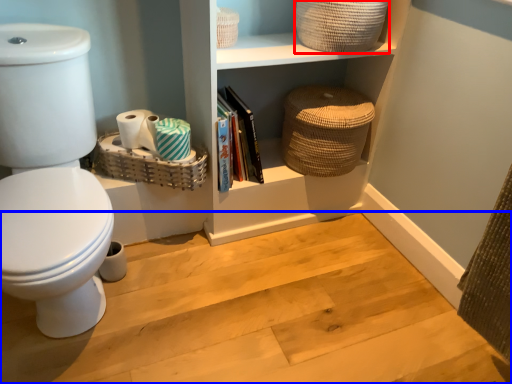
Question: Which point is further to the camera, basket (highlighted by a red box) or stair (highlighted by a blue box)?

Choices:
 (A) basket
 (B) stair

Answer: (A)